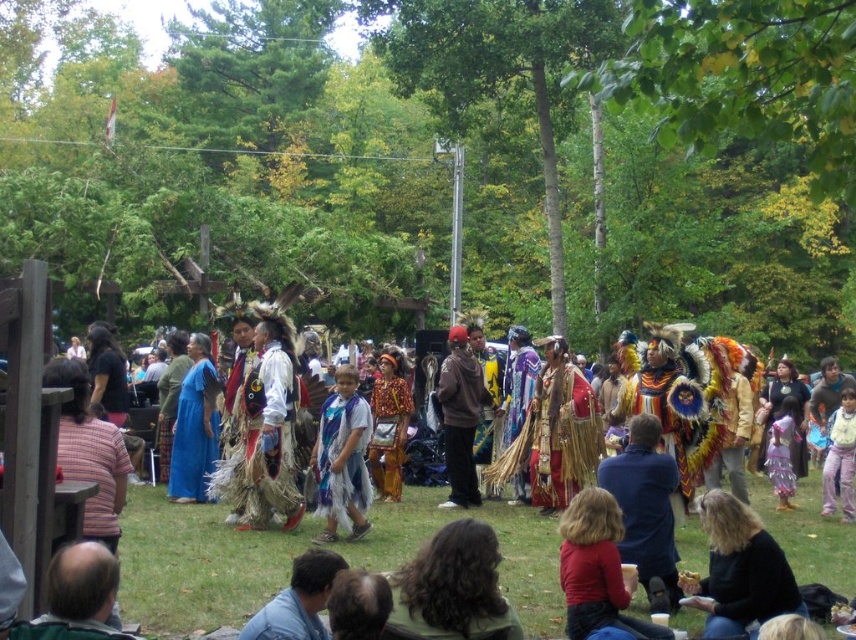
You are a photographer at the event and want to capture a photo of the shiny metallic headdress at center and brown suede jacket at center. Which object should you focus on first if you want to include both in your shot without moving the camera?

The shiny metallic headdress at center is not as tall as the brown suede jacket at center, so you should focus on the shiny metallic headdress at center first to ensure it is in frame before the taller jacket might block it.

You are a photographer at the event and want to capture a clear shot of both the shiny metallic headdress at center and the blue feathered headdress at center. However, you notice that one is blocking the other. Which headdress is obstructed by the other?

The shiny metallic headdress at center is positioned under the blue feathered headdress at center, so the shiny metallic headdress at center is obstructed by the blue feathered headdress at center.

From the picture: You are a photographer at the event and want to capture a photo that includes both the point at (253, 605) and the point at (461, 394). To ensure both points are in focus, you need to know which point is closer to the camera. Which point is closer?

Point at (253, 605) is in front of point at (461, 394), so it is closer to the camera.